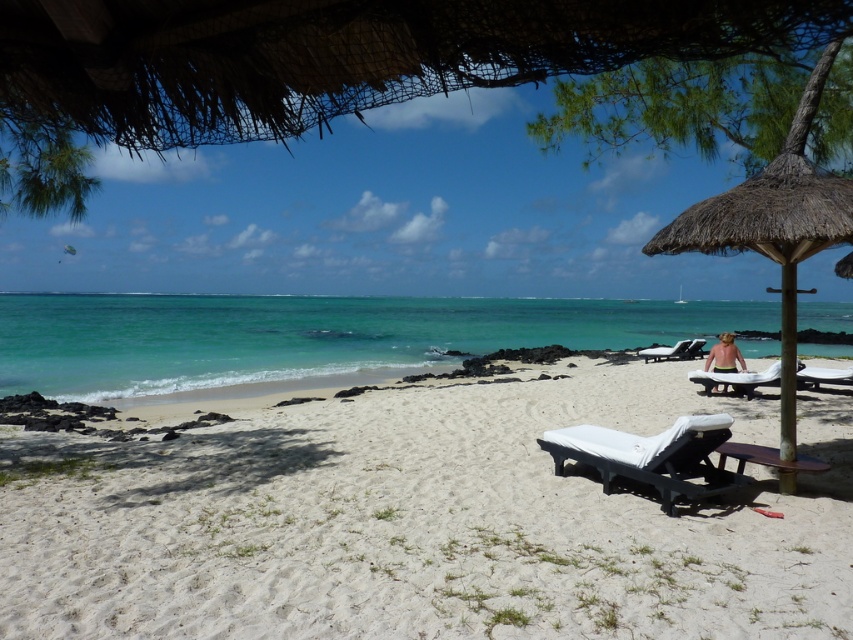
Is point (741, 224) more distant than point (747, 387)?

No.

Can you confirm if thatched straw umbrella at right is positioned to the left of white plastic beach chair at center-right?

Yes, thatched straw umbrella at right is to the left of white plastic beach chair at center-right.

This screenshot has width=853, height=640. What are the coordinates of `thatched straw umbrella at right` in the screenshot? It's located at (775, 230).

Does yellow fabric bikini at center come behind white fabric beach chair at center-right?

No.

Does yellow fabric bikini at center have a greater width compared to white fabric beach chair at center-right?

Correct, the width of yellow fabric bikini at center exceeds that of white fabric beach chair at center-right.

Which is behind, point (740, 362) or point (807, 374)?

Point (740, 362)

The height and width of the screenshot is (640, 853). Find the location of `yellow fabric bikini at center`. yellow fabric bikini at center is located at coordinates (724, 355).

Who is shorter, white sand at center or white matte beach chair at center?

white sand at center

Is point (347, 532) positioned behind point (720, 419)?

That is False.

Who is more forward, (747,552) or (711,445)?

Positioned in front is point (747,552).

You are a GUI agent. You are given a task and a screenshot of the screen. Output one action in this format:
    pyautogui.click(x=<x>, y=<y>)
    Task: Click on the white sand at center
    
    Given the screenshot: What is the action you would take?
    pyautogui.click(x=422, y=522)